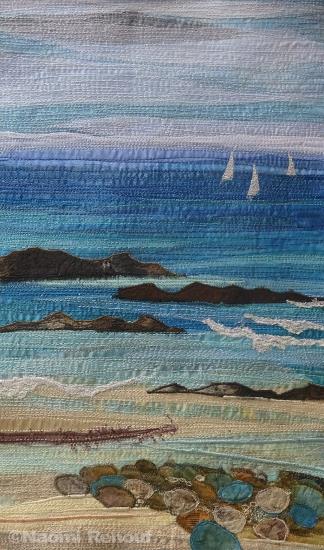
The width and height of the screenshot is (324, 550). I want to click on quiltwork, so click(282, 393).